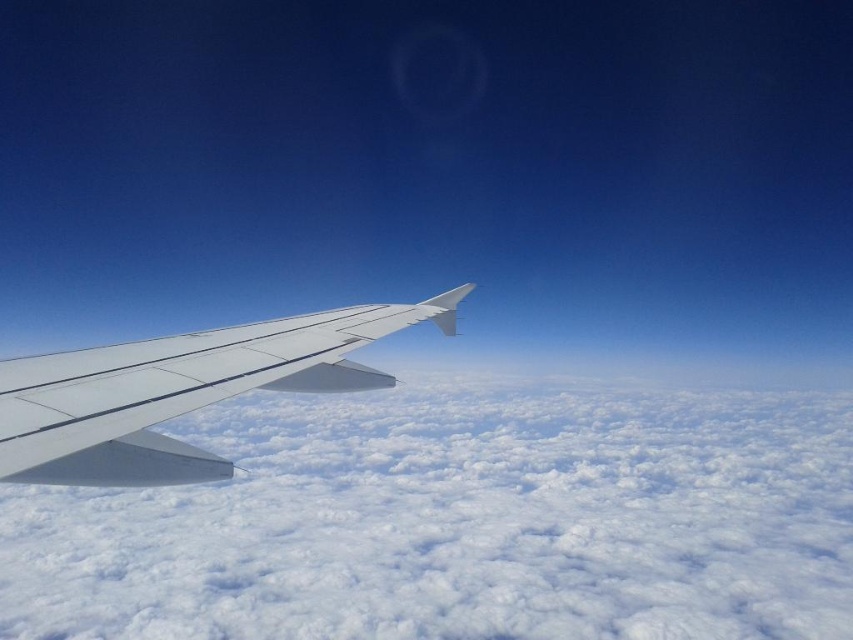
Can you confirm if white fluffy cloud at lower left is bigger than white matte wing at lower left?

Indeed, white fluffy cloud at lower left has a larger size compared to white matte wing at lower left.

Is white fluffy cloud at lower left positioned before white matte wing at lower left?

No, it is not.

Describe the element at coordinates (460, 520) in the screenshot. I see `white fluffy cloud at lower left` at that location.

This screenshot has width=853, height=640. I want to click on white fluffy cloud at lower left, so (460, 520).